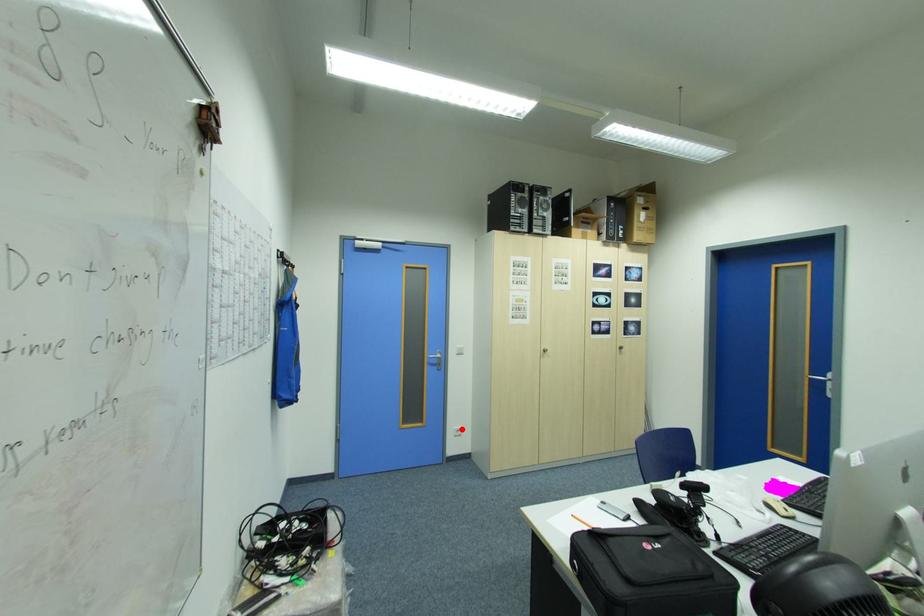
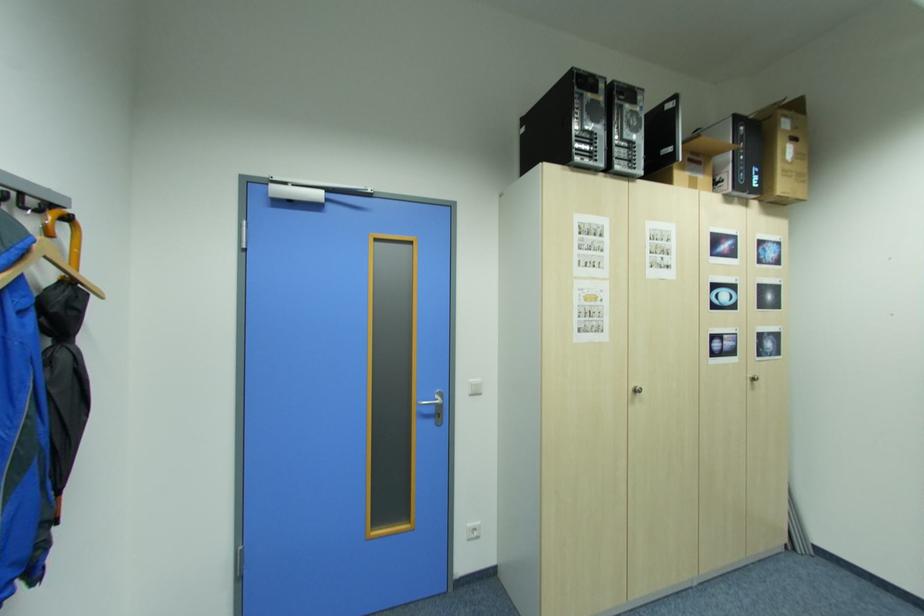
Question: I am providing you with two images of the same scene from different viewpoints. A red point is marked on the first image. Can you still see the location of the red point in image 2?

Choices:
 (A) Yes
 (B) No

Answer: (A)